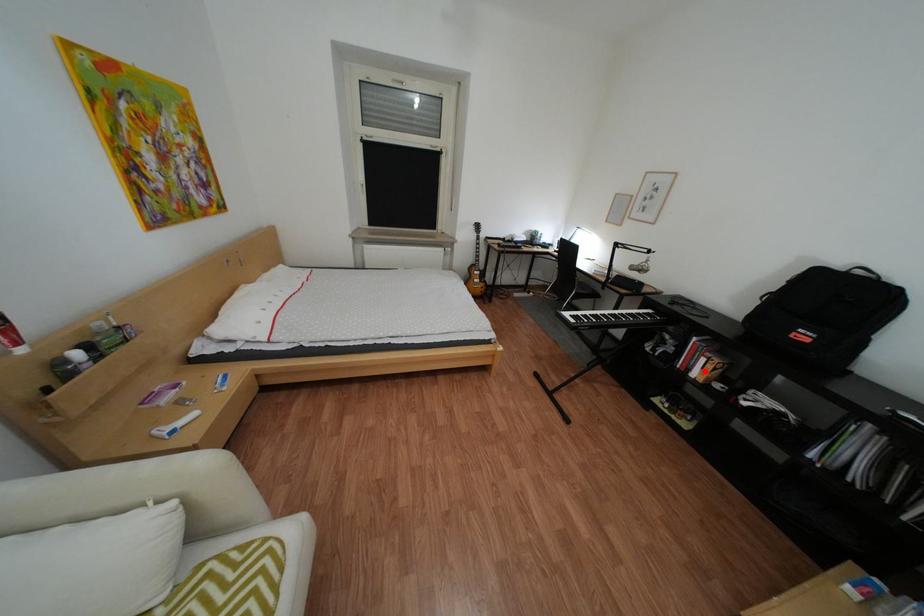
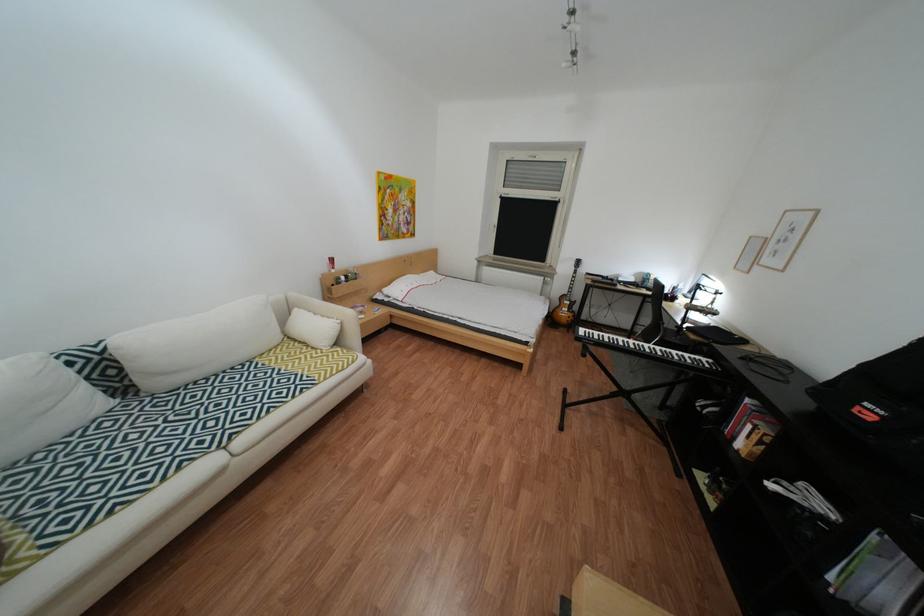
Question: I am providing you with two images of the same scene from different viewpoints. A red point is shown in image1. For the corresponding object point in image2, is it positioned nearer or farther from the camera?

Choices:
 (A) Nearer
 (B) Farther

Answer: (B)